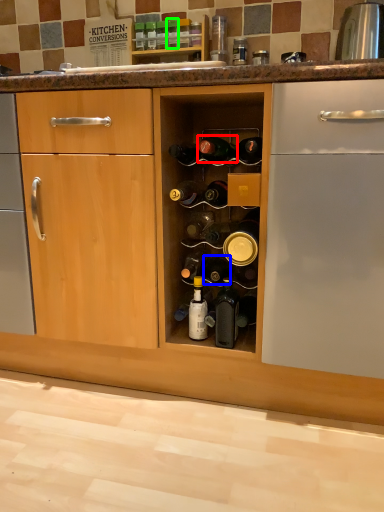
Question: Estimate the real-world distances between objects in this image. Which object is closer to beer bottle (highlighted by a red box), bottle (highlighted by a blue box) or bottle (highlighted by a green box)?

Choices:
 (A) bottle
 (B) bottle

Answer: (A)